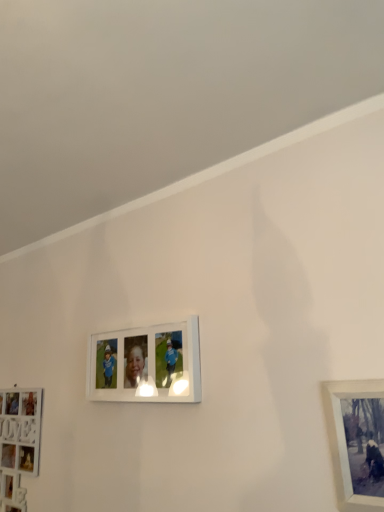
Question: Does white glossy picture frame at center, the 2th picture frame from the left, come behind metallic silver frame at lower right, which appears as the first picture frame when viewed from the right?

Choices:
 (A) no
 (B) yes

Answer: (B)

Question: Can you confirm if white glossy picture frame at center, which ranks as the second picture frame in right-to-left order, is smaller than metallic silver frame at lower right, the third picture frame from the left?

Choices:
 (A) yes
 (B) no

Answer: (B)

Question: Is white glossy picture frame at center, the 2th picture frame viewed from the front, bigger than metallic silver frame at lower right, the third picture frame from the left?

Choices:
 (A) yes
 (B) no

Answer: (A)

Question: Is white glossy picture frame at center, the 2th picture frame from the left, facing away from metallic silver frame at lower right, marked as the 1th picture frame in a front-to-back arrangement?

Choices:
 (A) no
 (B) yes

Answer: (A)

Question: Is white glossy picture frame at center, the 2th picture frame from the left, positioned far away from metallic silver frame at lower right, marked as the 1th picture frame in a front-to-back arrangement?

Choices:
 (A) yes
 (B) no

Answer: (B)

Question: In the image, is white glossy picture frame at center, which appears as the 2th picture frame when viewed from the back, on the left side or the right side of metallic silver frame at lower right, the 3th picture frame from the back?

Choices:
 (A) right
 (B) left

Answer: (B)

Question: Is white glossy picture frame at center, the 2th picture frame viewed from the front, taller or shorter than metallic silver frame at lower right, marked as the 1th picture frame in a front-to-back arrangement?

Choices:
 (A) short
 (B) tall

Answer: (A)

Question: From a real-world perspective, is white glossy picture frame at center, the 2th picture frame viewed from the front, above or below metallic silver frame at lower right, the 3th picture frame from the back?

Choices:
 (A) above
 (B) below

Answer: (A)

Question: In the image, is white glossy picture frame at center, which ranks as the second picture frame in right-to-left order, positioned in front of or behind metallic silver frame at lower right, the 3th picture frame from the back?

Choices:
 (A) front
 (B) behind

Answer: (B)

Question: Is white matte picture frame at lower left, the first picture frame positioned from the left, wider or thinner than white glossy picture frame at center, which appears as the 2th picture frame when viewed from the back?

Choices:
 (A) wide
 (B) thin

Answer: (B)

Question: Considering the positions of white matte picture frame at lower left, the 3th picture frame from the front, and white glossy picture frame at center, which appears as the 2th picture frame when viewed from the back, in the image, is white matte picture frame at lower left, the 3th picture frame from the front, taller or shorter than white glossy picture frame at center, which appears as the 2th picture frame when viewed from the back,?

Choices:
 (A) short
 (B) tall

Answer: (B)

Question: From the image's perspective, relative to white glossy picture frame at center, which appears as the 2th picture frame when viewed from the back, is white matte picture frame at lower left, which appears as the first picture frame when viewed from the back, above or below?

Choices:
 (A) below
 (B) above

Answer: (A)

Question: From a real-world perspective, is white matte picture frame at lower left, the 3th picture frame from the front, positioned above or below white glossy picture frame at center, which appears as the 2th picture frame when viewed from the back?

Choices:
 (A) above
 (B) below

Answer: (B)

Question: Is white matte picture frame at lower left, the first picture frame positioned from the left, in front of or behind metallic silver frame at lower right, marked as the 1th picture frame in a front-to-back arrangement, in the image?

Choices:
 (A) front
 (B) behind

Answer: (B)

Question: From the image's perspective, is white matte picture frame at lower left, the first picture frame positioned from the left, above or below metallic silver frame at lower right, which appears as the first picture frame when viewed from the right?

Choices:
 (A) below
 (B) above

Answer: (A)